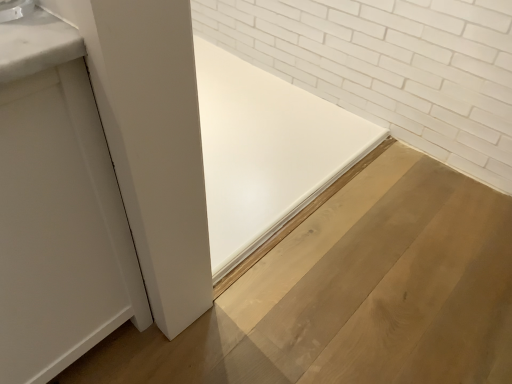
Question: In the image, is white matte door at left positioned in front of or behind natural wood plywood at center?

Choices:
 (A) front
 (B) behind

Answer: (A)

Question: Is white matte door at left inside or outside of natural wood plywood at center?

Choices:
 (A) inside
 (B) outside

Answer: (B)

Question: Considering the real-world distances, which object is farthest from the satin nickel faucet at upper left?

Choices:
 (A) white matte door at left
 (B) natural wood plywood at center

Answer: (B)

Question: Which of these objects is positioned closest to the white matte door at left?

Choices:
 (A) satin nickel faucet at upper left
 (B) natural wood plywood at center

Answer: (A)